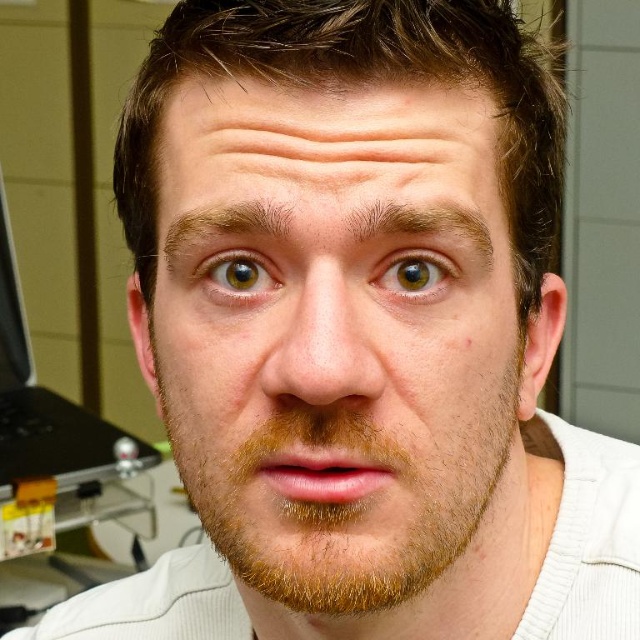
Question: Which object is positioned farthest from the black plastic laptop at left?

Choices:
 (A) green matte eye at center
 (B) smooth skin face at center

Answer: (A)

Question: Can you confirm if green matte eye at upper center is smaller than green matte eye at center?

Choices:
 (A) yes
 (B) no

Answer: (A)

Question: Which object is positioned closest to the black plastic laptop at left?

Choices:
 (A) green matte eye at center
 (B) smooth skin face at center

Answer: (B)

Question: Is smooth skin face at center to the left of black plastic laptop at left from the viewer's perspective?

Choices:
 (A) yes
 (B) no

Answer: (B)

Question: Considering the real-world distances, which object is closest to the green matte eye at upper center?

Choices:
 (A) black plastic laptop at left
 (B) smooth skin face at center
 (C) green matte eye at center

Answer: (C)

Question: In this image, where is smooth skin face at center located relative to black plastic laptop at left?

Choices:
 (A) right
 (B) left

Answer: (A)